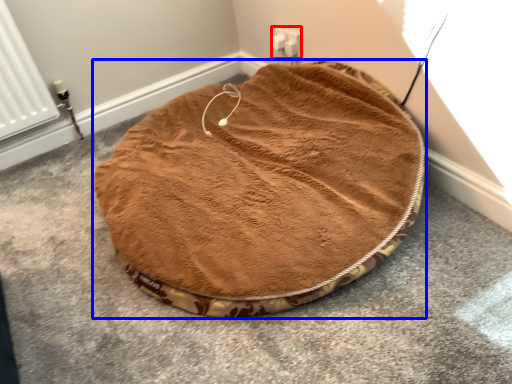
Question: Which object appears farthest to the camera in this image, electric outlet (highlighted by a red box) or dog bed (highlighted by a blue box)?

Choices:
 (A) electric outlet
 (B) dog bed

Answer: (A)